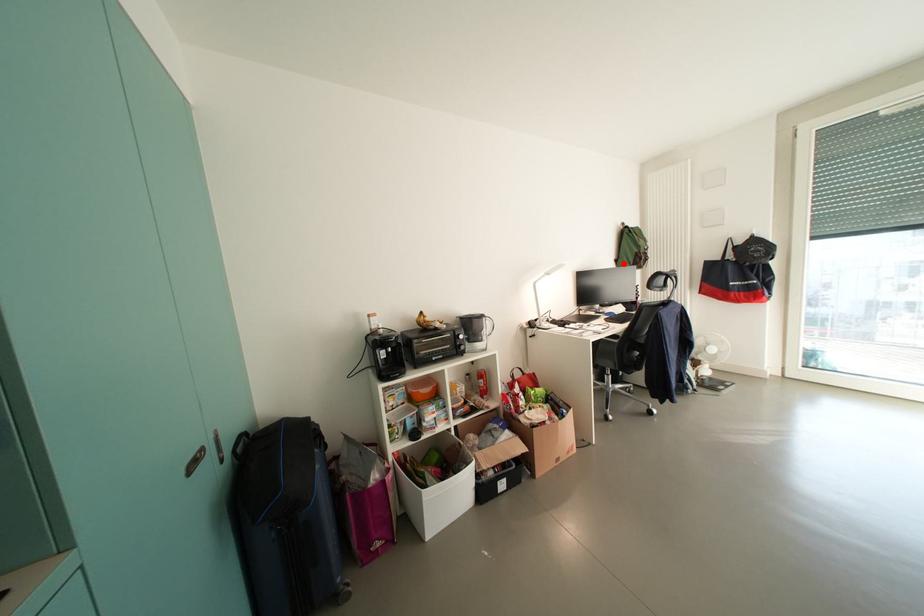
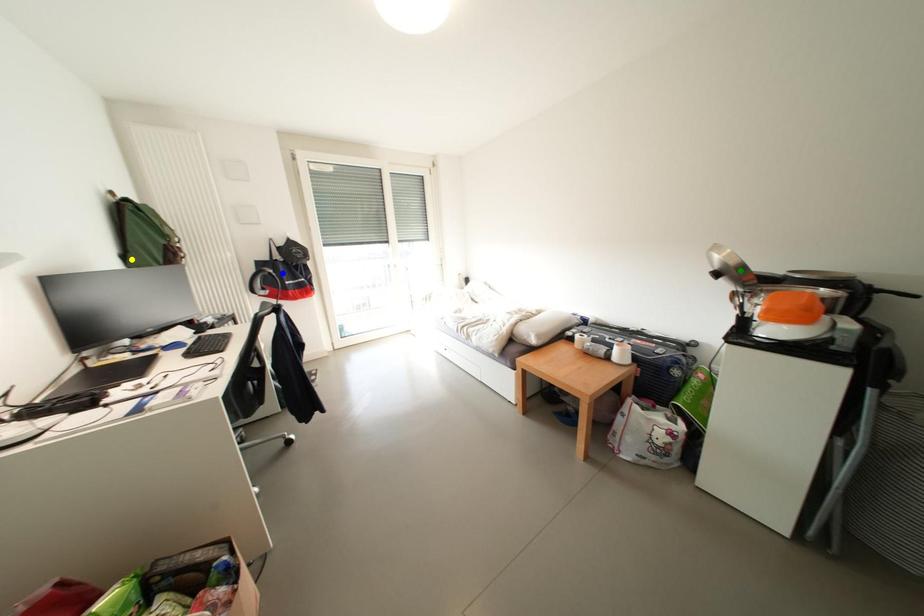
Question: I am providing you with two images of the same scene from different viewpoints. A red point is marked on the first image. You are given multiple points on the second image. Which spot in image 2 lines up with the point in image 1?

Choices:
 (A) yellow point
 (B) green point
 (C) blue point

Answer: (A)